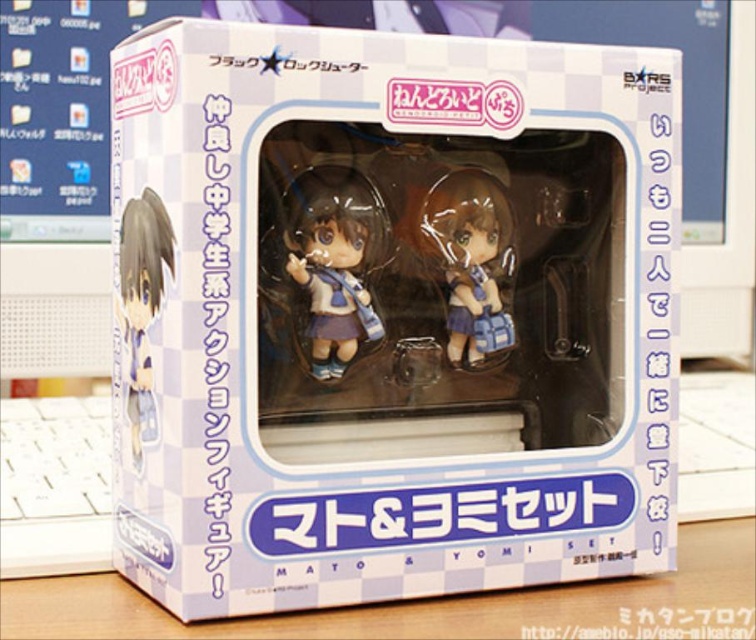
Question: Which object appears farthest from the camera in this image?

Choices:
 (A) matte blue plastic figurine at left
 (B) white glossy box at center

Answer: (A)

Question: Does satin blue doll at center have a greater width compared to matte blue plastic figurine at left?

Choices:
 (A) no
 (B) yes

Answer: (B)

Question: Does white glossy box at center come in front of wooden table at center?

Choices:
 (A) yes
 (B) no

Answer: (A)

Question: Which object appears closest to the camera in this image?

Choices:
 (A) matte blue plastic figurine at left
 (B) satin blue doll at center
 (C) wooden table at center

Answer: (C)

Question: Among these objects, which one is farthest from the camera?

Choices:
 (A) satin blue doll at center
 (B) white glossy box at center
 (C) matte plastic figurine at center
 (D) matte blue plastic figurine at left

Answer: (C)

Question: Is satin blue doll at center below matte blue plastic figurine at left?

Choices:
 (A) no
 (B) yes

Answer: (A)